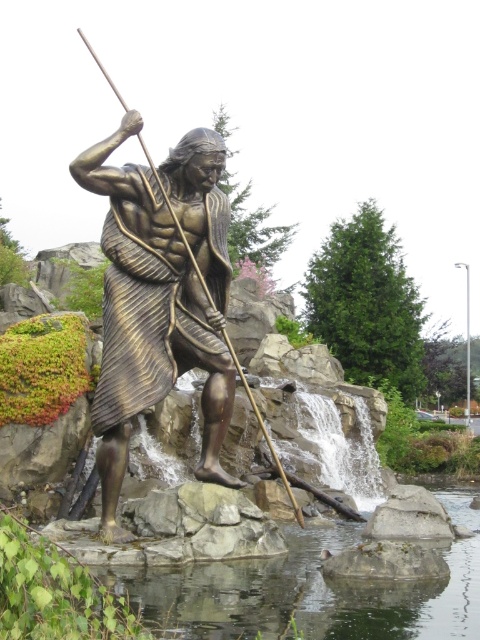
Between point (121, 266) and point (414, 625), which one is positioned in front?

Point (414, 625)

Is point (215, 312) positioned before point (219, 589)?

That is False.

Who is more forward, [165,234] or [300,548]?

Point [165,234] is in front.

Where is `bronze statue at center`? This screenshot has height=640, width=480. bronze statue at center is located at coordinates click(x=158, y=298).